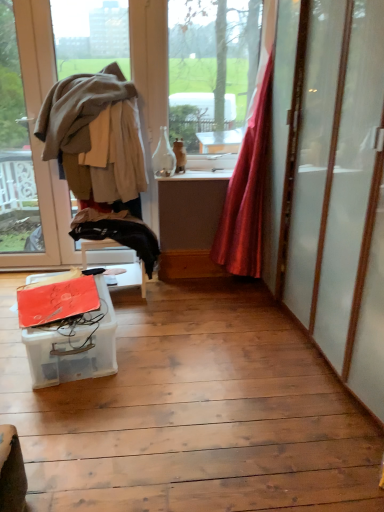
Question: Is matte beige window at left far from silky red curtain at right?

Choices:
 (A) yes
 (B) no

Answer: (A)

Question: Would you say matte beige window at left contains silky red curtain at right?

Choices:
 (A) yes
 (B) no

Answer: (B)

Question: From the image's perspective, is matte beige window at left under silky red curtain at right?

Choices:
 (A) yes
 (B) no

Answer: (B)

Question: Considering the relative positions of matte beige window at left and silky red curtain at right in the image provided, is matte beige window at left in front of silky red curtain at right?

Choices:
 (A) no
 (B) yes

Answer: (A)

Question: From a real-world perspective, does matte beige window at left sit lower than silky red curtain at right?

Choices:
 (A) yes
 (B) no

Answer: (B)

Question: Are matte beige window at left and silky red curtain at right beside each other?

Choices:
 (A) yes
 (B) no

Answer: (B)

Question: From a real-world perspective, is silky red curtain at right on light brown fabric at left?

Choices:
 (A) no
 (B) yes

Answer: (A)

Question: From the image's perspective, is silky red curtain at right beneath light brown fabric at left?

Choices:
 (A) no
 (B) yes

Answer: (B)

Question: Is light brown fabric at left a part of silky red curtain at right?

Choices:
 (A) yes
 (B) no

Answer: (B)

Question: Considering the relative sizes of silky red curtain at right and light brown fabric at left in the image provided, is silky red curtain at right smaller than light brown fabric at left?

Choices:
 (A) no
 (B) yes

Answer: (B)

Question: Is silky red curtain at right oriented towards light brown fabric at left?

Choices:
 (A) yes
 (B) no

Answer: (B)

Question: Would you say silky red curtain at right is outside light brown fabric at left?

Choices:
 (A) no
 (B) yes

Answer: (B)

Question: Is translucent plastic container at lower left taller than silky red curtain at right?

Choices:
 (A) no
 (B) yes

Answer: (A)